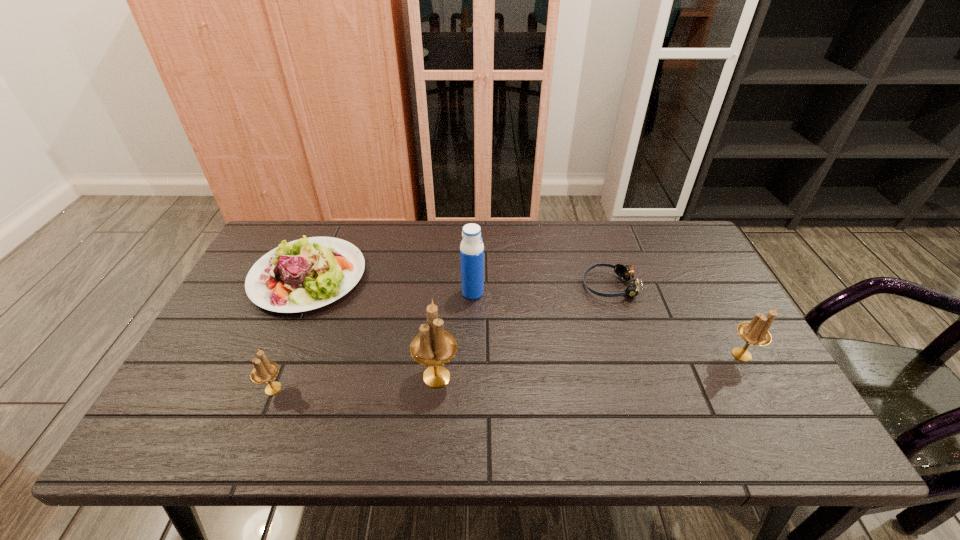
At what (x,y) coordinates should I click in order to perform the action: click on object at the far left corner. Please return your answer as a coordinate pair (x, y). Looking at the image, I should click on 305,274.

At what (x,y) coordinates should I click in order to perform the action: click on vacant space at the far edge. Please return your answer as a coordinate pair (x, y). The width and height of the screenshot is (960, 540). Looking at the image, I should click on [555, 233].

Where is `vacant area at the near edge`? The width and height of the screenshot is (960, 540). vacant area at the near edge is located at coordinates (301, 382).

Locate an element on the screen. This screenshot has width=960, height=540. free space at the far left corner of the desktop is located at coordinates (314, 231).

At what (x,y) coordinates should I click in order to perform the action: click on free space at the far right corner of the desktop. Please return your answer as a coordinate pair (x, y). This screenshot has height=540, width=960. Looking at the image, I should click on (675, 238).

Where is `free point between the fifth tallest object and the fourth tallest object`? free point between the fifth tallest object and the fourth tallest object is located at coordinates (291, 333).

Where is `empty space that is in between the water bottle and the leftmost candle holder`? empty space that is in between the water bottle and the leftmost candle holder is located at coordinates (372, 341).

Locate an element on the screen. The image size is (960, 540). free spot between the second candle holder from right to left and the rightmost candle holder is located at coordinates (589, 366).

Find the location of a particular element. The width and height of the screenshot is (960, 540). free spot between the tallest candle holder and the goggles is located at coordinates (523, 331).

The image size is (960, 540). What are the coordinates of `unoccupied position between the rightmost candle holder and the shortest object` in the screenshot? It's located at (676, 320).